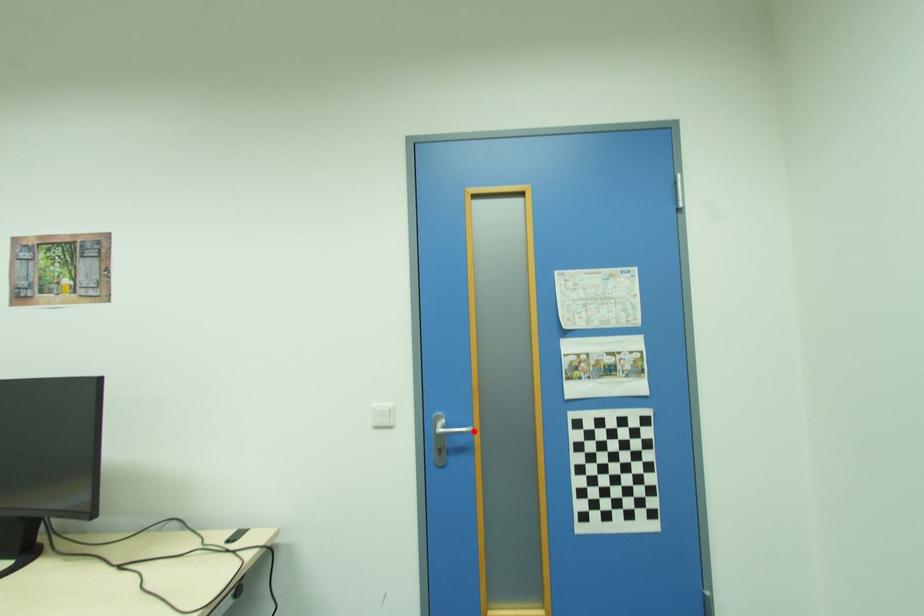
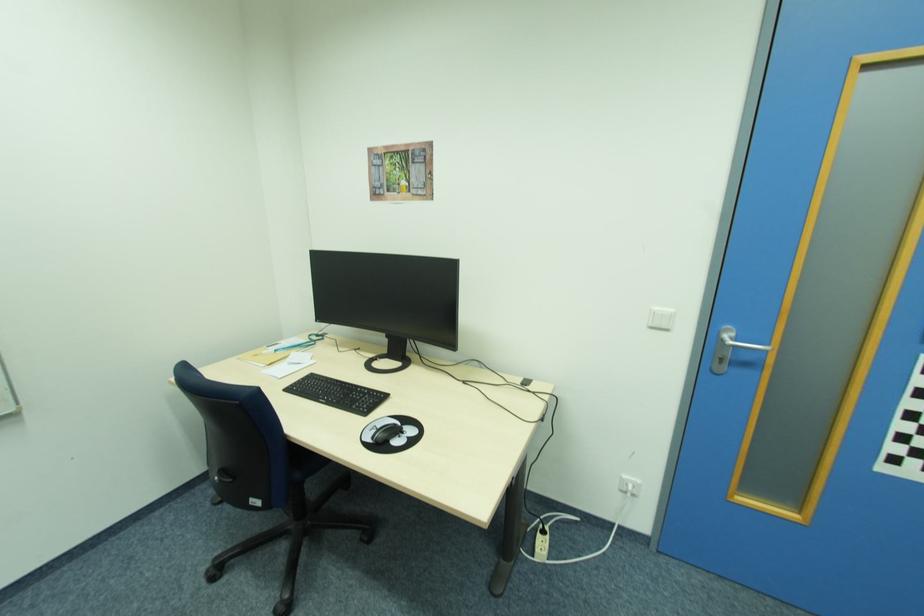
Find the pixel in the second image that matches the highlighted location in the first image.

(768, 350)